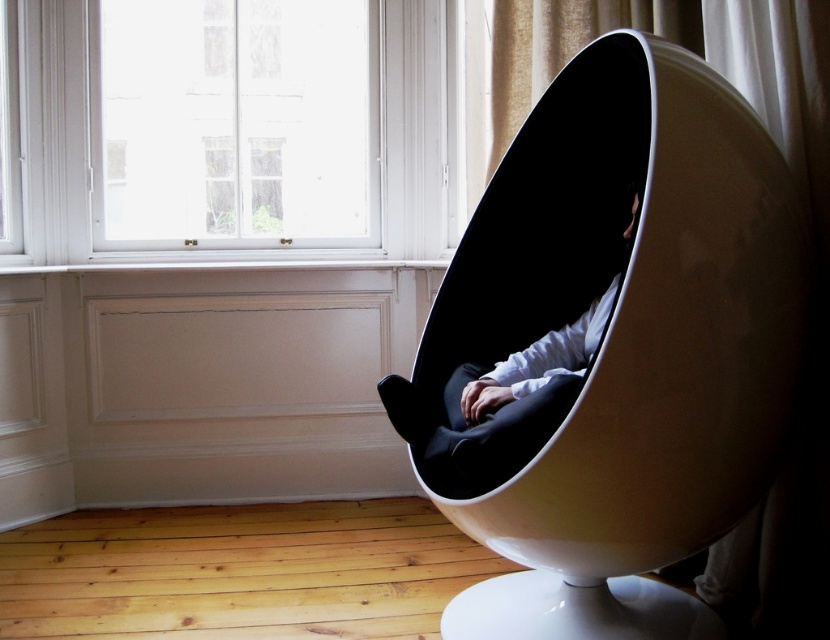
Question: Which object is the farthest from the transparent glass window at upper center?

Choices:
 (A) matte black egg chair at center
 (B) matte white egg-shaped chair at right

Answer: (B)

Question: Is matte white egg-shaped chair at right to the right of matte black egg chair at center from the viewer's perspective?

Choices:
 (A) yes
 (B) no

Answer: (A)

Question: Is matte white egg-shaped chair at right above matte black egg chair at center?

Choices:
 (A) yes
 (B) no

Answer: (B)

Question: Among these objects, which one is farthest from the camera?

Choices:
 (A) matte black egg chair at center
 (B) transparent glass window at upper center
 (C) matte white egg-shaped chair at right

Answer: (B)

Question: Is matte white egg-shaped chair at right positioned in front of matte black egg chair at center?

Choices:
 (A) yes
 (B) no

Answer: (A)

Question: Based on their relative distances, which object is nearer to the matte black egg chair at center?

Choices:
 (A) matte white egg-shaped chair at right
 (B) transparent glass window at upper center

Answer: (A)